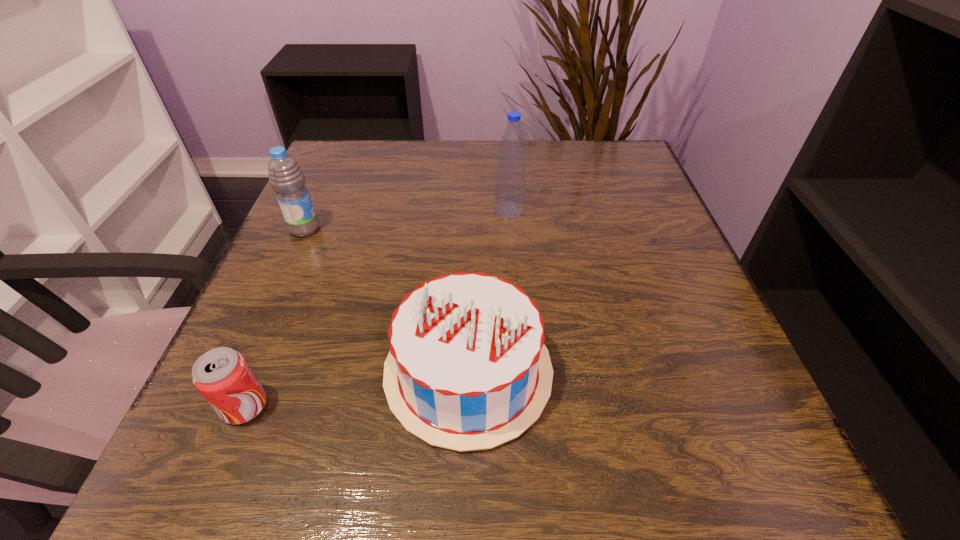
Identify the location of the taller water bottle. (510, 182).

Identify the location of the farthest object. The width and height of the screenshot is (960, 540). (510, 182).

At what (x,y) coordinates should I click in order to perform the action: click on the shorter water bottle. Please return your answer as a coordinate pair (x, y). The width and height of the screenshot is (960, 540). Looking at the image, I should click on (286, 178).

The height and width of the screenshot is (540, 960). I want to click on the third shortest object, so [286, 178].

Locate an element on the screen. the second shortest object is located at coordinates (467, 369).

Where is `the shortest object`? the shortest object is located at coordinates point(222,375).

Locate an element on the screen. free location located on the front of the farthest object is located at coordinates (515, 279).

The width and height of the screenshot is (960, 540). In order to click on vacant region located 0.140m on the front of the shorter water bottle in this screenshot , I will do `click(277, 290)`.

Identify the location of blank space located on the right of the birthday cake. The height and width of the screenshot is (540, 960). (731, 371).

Where is `vacant space located 0.210m on the back of the soda can`? vacant space located 0.210m on the back of the soda can is located at coordinates (295, 284).